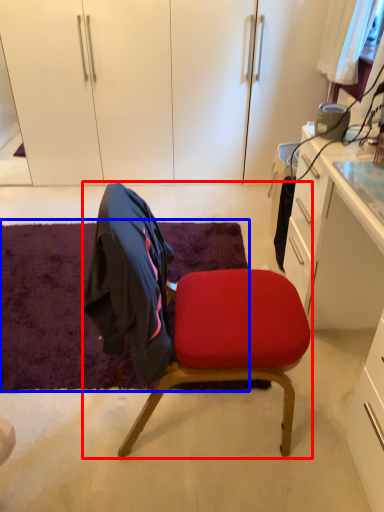
Question: Among these objects, which one is nearest to the camera, chair (highlighted by a red box) or mat (highlighted by a blue box)?

Choices:
 (A) chair
 (B) mat

Answer: (A)